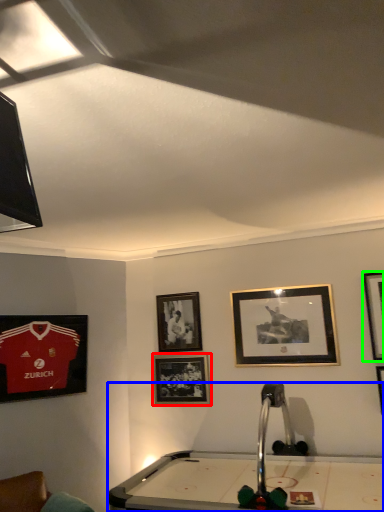
Question: Based on their relative distances, which object is nearer to picture frame (highlighted by a red box)? Choose from billiard table (highlighted by a blue box) and picture frame (highlighted by a green box).

Choices:
 (A) billiard table
 (B) picture frame

Answer: (A)